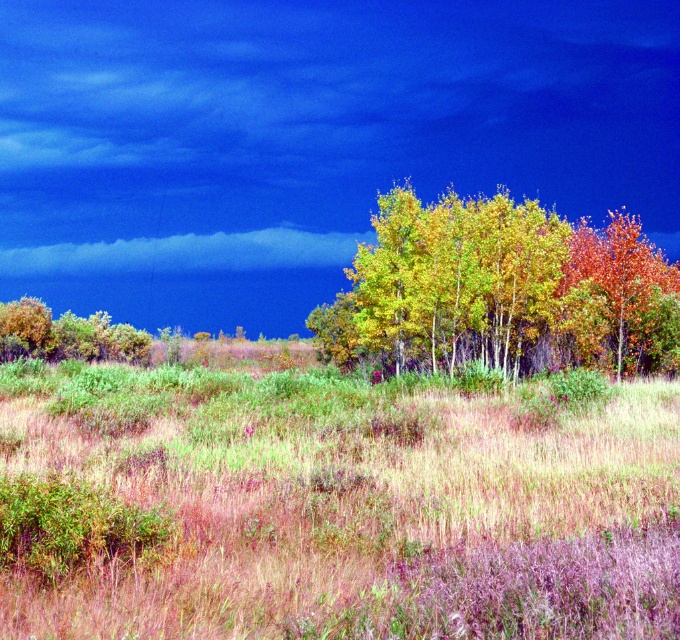
Does point (184, 589) come farther from viewer compared to point (239, 260)?

That is False.

Can you confirm if dry grass at center is taller than cloudy blue sky at upper center?

In fact, dry grass at center may be shorter than cloudy blue sky at upper center.

Is point (63, 388) positioned after point (245, 244)?

No.

Find the location of `dry grass at center`. dry grass at center is located at coordinates (333, 502).

Which of these two, dry grass at center or golden yellow leaves at center, stands shorter?

With less height is dry grass at center.

From the picture: Which is more to the left, dry grass at center or golden yellow leaves at center?

Positioned to the left is dry grass at center.

Locate an element on the screen. This screenshot has height=640, width=680. dry grass at center is located at coordinates (333, 502).

Based on the photo, is dry grass at center to the right of green leafy tree at left from the viewer's perspective?

Correct, you'll find dry grass at center to the right of green leafy tree at left.

Can you confirm if dry grass at center is shorter than green leafy tree at left?

Yes, dry grass at center is shorter than green leafy tree at left.

Between point (670, 636) and point (141, 336), which one is positioned behind?

Positioned behind is point (141, 336).

Identify the location of dry grass at center. This screenshot has width=680, height=640. (333, 502).